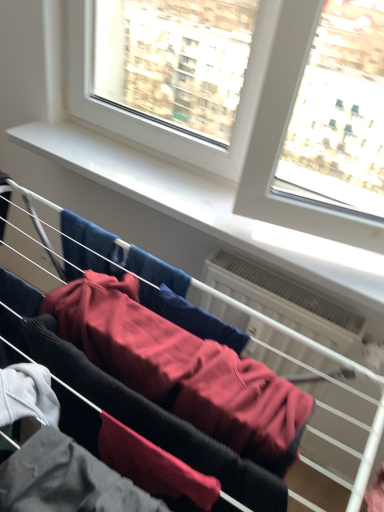
Image resolution: width=384 pixels, height=512 pixels. I want to click on matte red sweater at center, so click(x=182, y=369).

This screenshot has height=512, width=384. Describe the element at coordinates (182, 369) in the screenshot. I see `matte red sweater at center` at that location.

Where is `matte red sweater at center`? The width and height of the screenshot is (384, 512). matte red sweater at center is located at coordinates (182, 369).